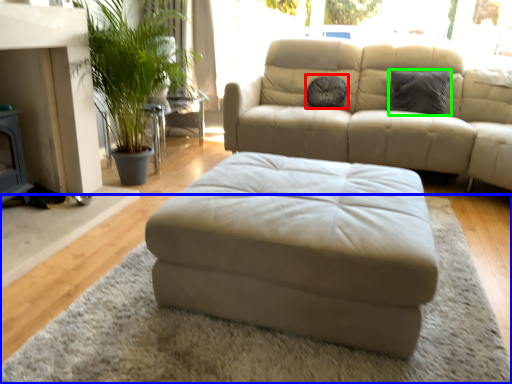
Question: Estimate the real-world distances between objects in this image. Which object is farther from pillow (highlighted by a red box), mat (highlighted by a blue box) or pillow (highlighted by a green box)?

Choices:
 (A) mat
 (B) pillow

Answer: (A)